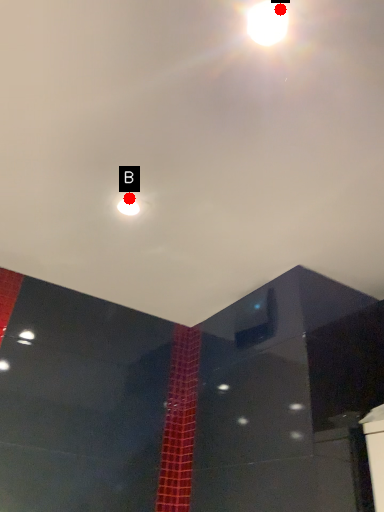
Question: Two points are circled on the image, labeled by A and B beside each circle. Which point is closer to the camera?

Choices:
 (A) A is closer
 (B) B is closer

Answer: (A)